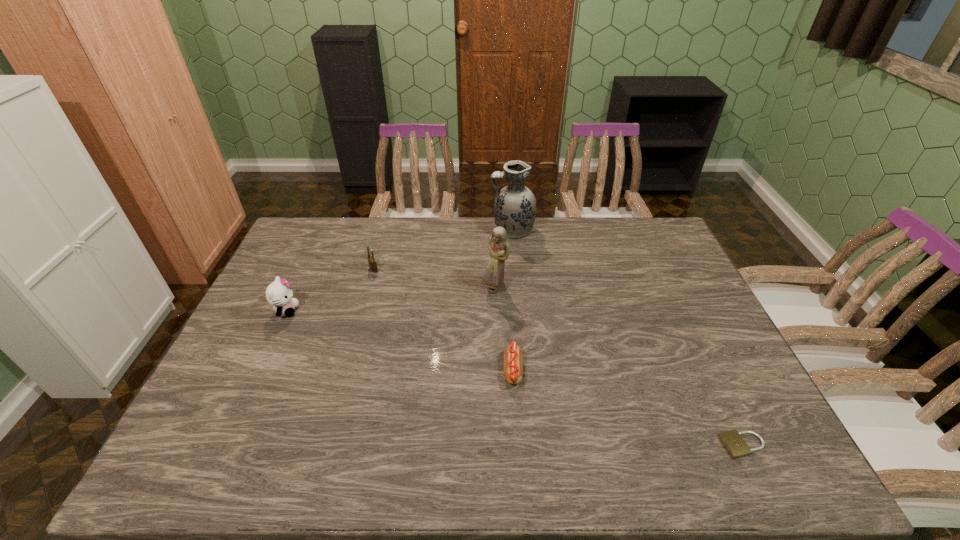
Find the location of a particular element. The width and height of the screenshot is (960, 540). vacant space located 0.060m with the handle on the side of the vase is located at coordinates (473, 230).

This screenshot has height=540, width=960. What are the coordinates of `vacant space located 0.230m with the handle on the side of the vase` in the screenshot? It's located at (427, 230).

This screenshot has height=540, width=960. I want to click on vacant region located 0.260m with the handle on the side of the vase, so click(419, 230).

Locate an element on the screen. The image size is (960, 540). free spot located 0.170m on the front-facing side of the figurine is located at coordinates (496, 340).

Where is `vacant region located on the front-facing side of the kitten`? The width and height of the screenshot is (960, 540). vacant region located on the front-facing side of the kitten is located at coordinates (389, 310).

Locate an element on the screen. The height and width of the screenshot is (540, 960). vacant area situated 0.090m on the back of the farther padlock is located at coordinates (379, 249).

Where is `blank space located on the front of the sausage`? blank space located on the front of the sausage is located at coordinates point(519,462).

At what (x,y) coordinates should I click in order to perform the action: click on vacant space located on the left of the nearer padlock. Please return your answer as a coordinate pair (x, y). The image size is (960, 540). Looking at the image, I should click on (641, 445).

Image resolution: width=960 pixels, height=540 pixels. What are the coordinates of `object located in the far edge section of the desktop` in the screenshot? It's located at (515, 205).

At what (x,y) coordinates should I click in order to perform the action: click on object that is positioned at the near edge. Please return your answer as a coordinate pair (x, y). The width and height of the screenshot is (960, 540). Looking at the image, I should click on (733, 442).